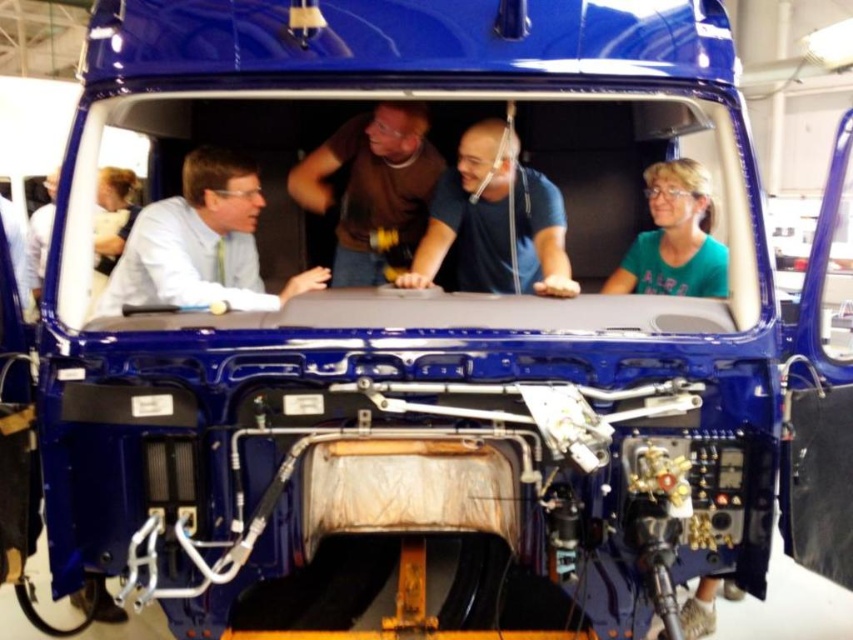
Question: Which of these objects is positioned farthest from the matte white shirt at left?

Choices:
 (A) green matte shirt at center
 (B) brown cotton shirt at center
 (C) blue cotton shirt at center

Answer: (A)

Question: Among these points, which one is farthest from the camera?

Choices:
 (A) click(x=143, y=268)
 (B) click(x=518, y=182)
 (C) click(x=424, y=225)
 (D) click(x=614, y=284)

Answer: (C)

Question: Is matte white shirt at left in front of brown cotton shirt at center?

Choices:
 (A) no
 (B) yes

Answer: (B)

Question: Does matte white shirt at left appear under blue cotton shirt at center?

Choices:
 (A) no
 (B) yes

Answer: (B)

Question: Which of the following is the farthest from the observer?

Choices:
 (A) (151, 243)
 (B) (497, 266)

Answer: (B)

Question: In this image, where is matte white shirt at left located relative to green matte shirt at center?

Choices:
 (A) right
 (B) left

Answer: (B)